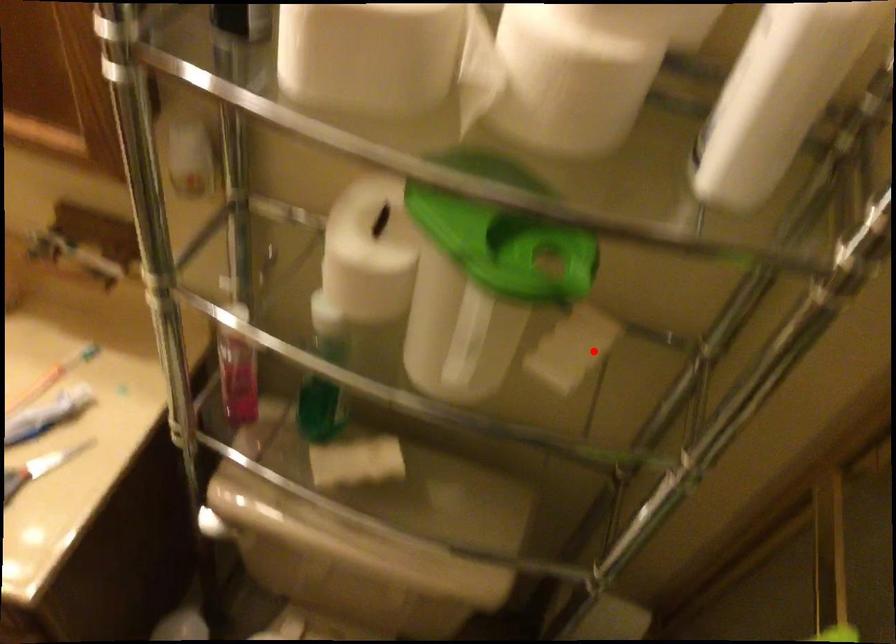
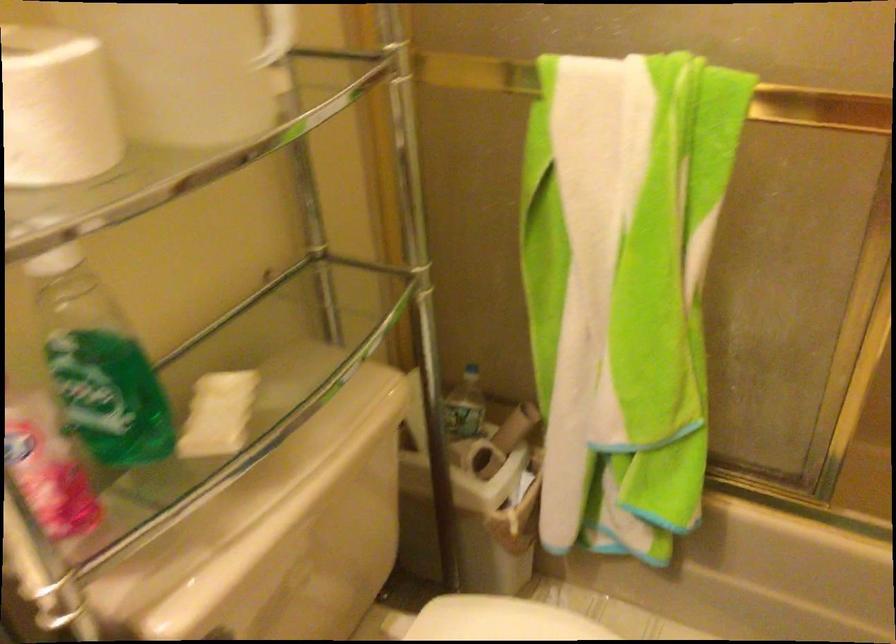
Locate, in the second image, the point that corresponds to the highlighted location in the first image.

(270, 64)